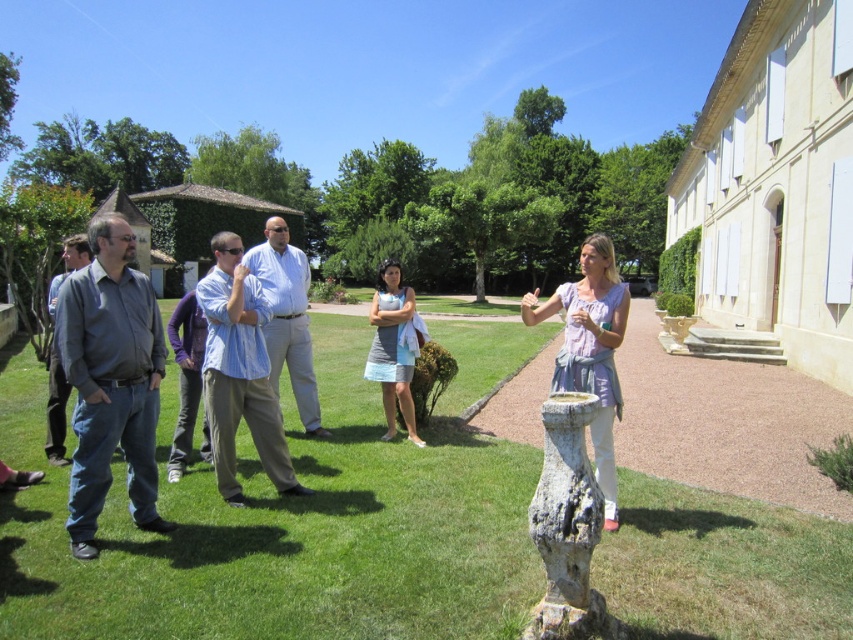
Is dark gray shirt at center positioned behind light blue denim dress at center?

No, it is not.

Who is taller, dark gray shirt at center or light blue denim dress at center?

dark gray shirt at center

Is point (122, 248) positioned before point (390, 371)?

Yes, point (122, 248) is in front of point (390, 371).

Identify the location of dark gray shirt at center. (109, 380).

Looking at this image, can you confirm if light blue shirt at center is shorter than blue striped shirt at center?

Indeed, light blue shirt at center has a lesser height compared to blue striped shirt at center.

Does light blue shirt at center have a larger size compared to blue striped shirt at center?

Actually, light blue shirt at center might be smaller than blue striped shirt at center.

Who is more forward, (207,401) or (281,232)?

Point (207,401) is in front.

Find the location of `light blue shirt at center`. light blue shirt at center is located at coordinates [239, 371].

Can you confirm if light blue shirt at center is shorter than matte gray suit at left?

No, light blue shirt at center is not shorter than matte gray suit at left.

Is light blue shirt at center further to the viewer compared to matte gray suit at left?

No, light blue shirt at center is in front of matte gray suit at left.

Find the location of a particular element. The height and width of the screenshot is (640, 853). light blue shirt at center is located at coordinates (239, 371).